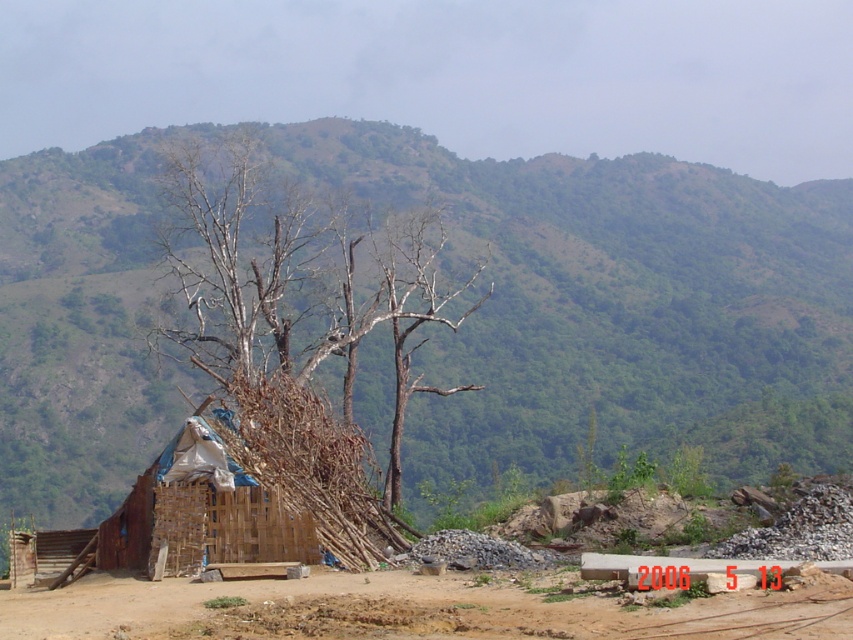
You are standing at the makeshift shelter and looking towards the two points marked in the image. Which point, point (714, 467) or point (426, 320), is closer to you?

Point (426, 320) is closer to you because it is closer to the camera than point (714, 467).

You are standing at the makeshift shelter and want to walk to the point marked as point [218,618]. Which direction should you move relative to point [355,403]?

You should move away from point [355,403] because point [218,618] is further away from the viewer than point [355,403].